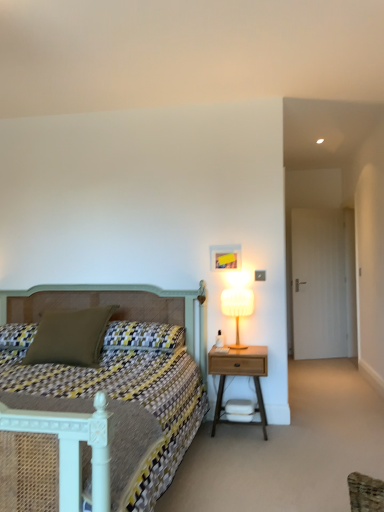
Locate an element on the screen. The image size is (384, 512). free space in front of wooden nightstand at right is located at coordinates (256, 451).